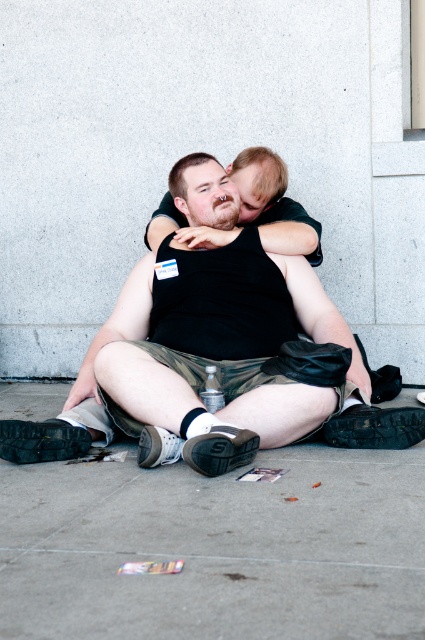
You are a photographer trying to capture a candid shot of the two people in the image. You notice the black matte tank top at center and the smooth black shirt at center. Which one is positioned lower in the frame?

The black matte tank top at center is located below the smooth black shirt at center, so it is positioned lower in the frame.

You are planning to place a small potted plant on the gray concrete pavement at lower center next to the smooth black shirt at center. Considering their sizes, which surface can accommodate the plant better?

The gray concrete pavement at lower center has a larger size compared to the smooth black shirt at center, so it can accommodate the plant better.